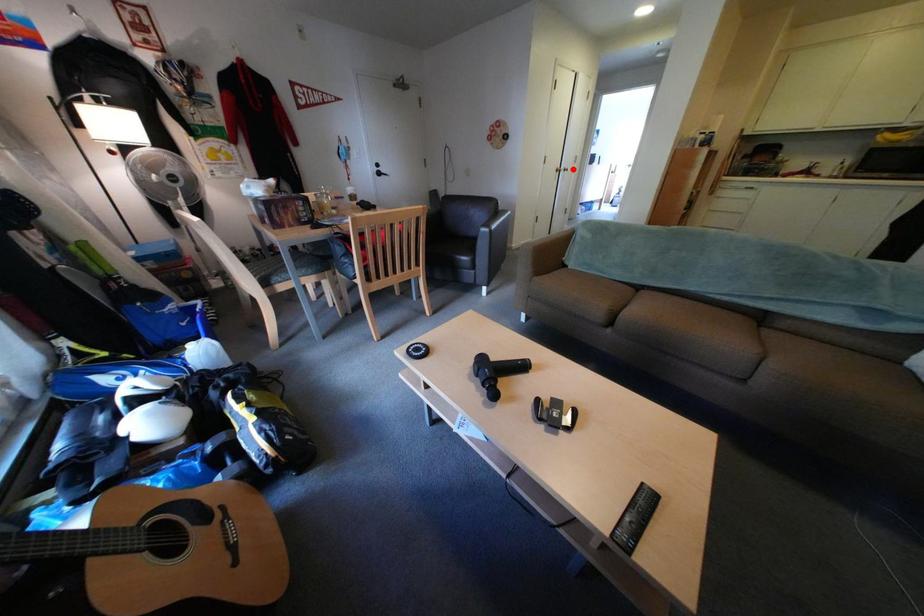
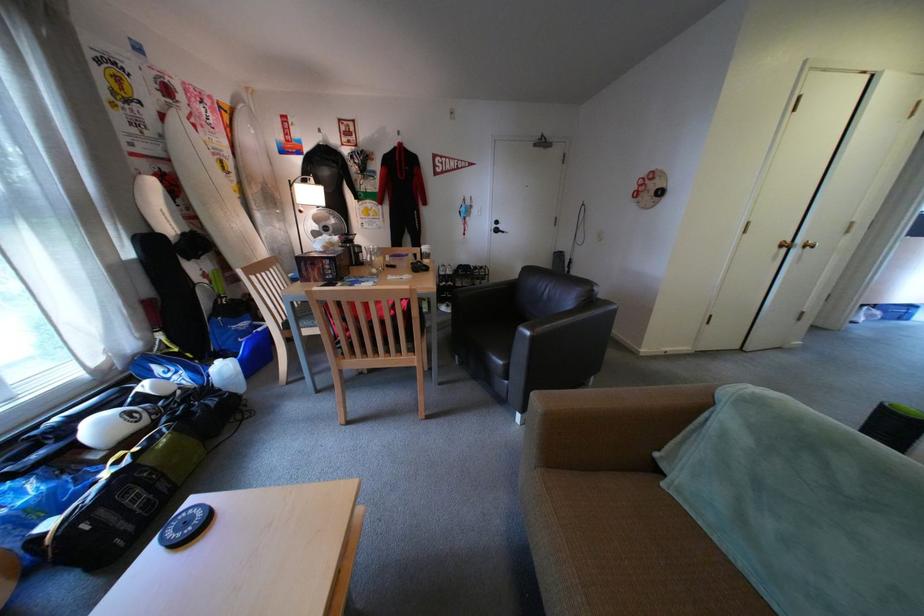
Question: I am providing you with two images of the same scene from different viewpoints. In image1, a red point is highlighted. Considering the same 3D point in image2, which of the following is correct?

Choices:
 (A) It is closer
 (B) It is farther

Answer: (B)